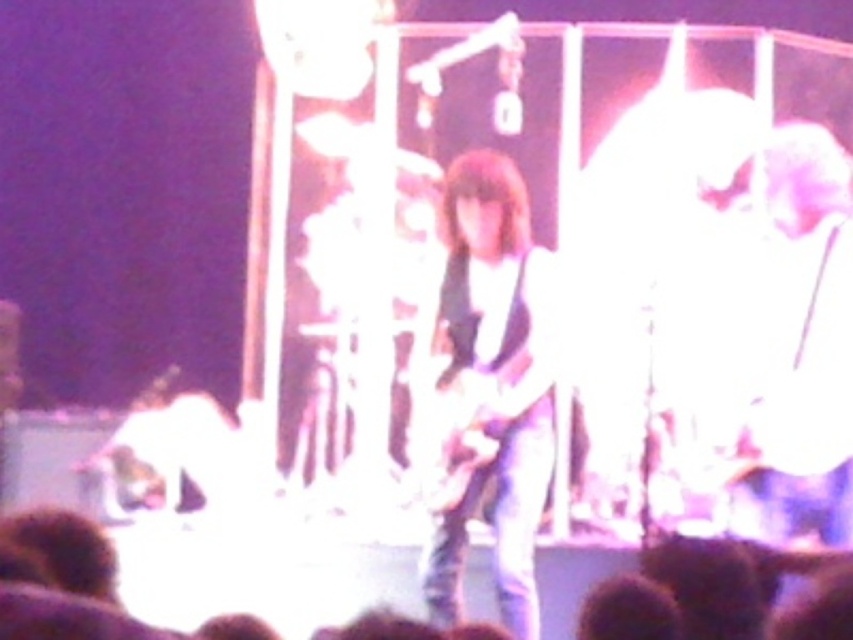
You are a stagehand setting up for a concert. You need to place a microphone stand between the matte black guitar at center and the shiny metallic guitar at center. Since the microphone stand requires 1 meter of space, can you fit it between them based on their sizes?

The matte black guitar at center is taller than the shiny metallic guitar at center, but the description does not provide information about their widths or distance between them. Therefore, it is impossible to determine if the microphone stand can fit between them based on the given details.

You are at a concert venue and want to take a photo of the stage. The camera you have can focus on objects up to 100 feet away. Is the point at coordinates point [485,477] within the camera focus range?

The point at coordinates point [485,477] is 106.37 feet away from the camera, which exceeds the camera focus range of 100 feet. Therefore, the camera cannot focus on it.

You are a photographer at a concert venue. You need to position a spotlight so that it illuminates the matte black guitar at center and the shiny metallic guitar at center without overlapping the audience silhouettes. Based on their positions, which guitar should you aim the spotlight towards first to ensure proper coverage?

The matte black guitar at center is to the left of the shiny metallic guitar at center. Since the spotlight needs to avoid the audience silhouettes, you should aim it towards the matte black guitar at center first as it is positioned further left and away from the audience, ensuring proper coverage without overlapping.